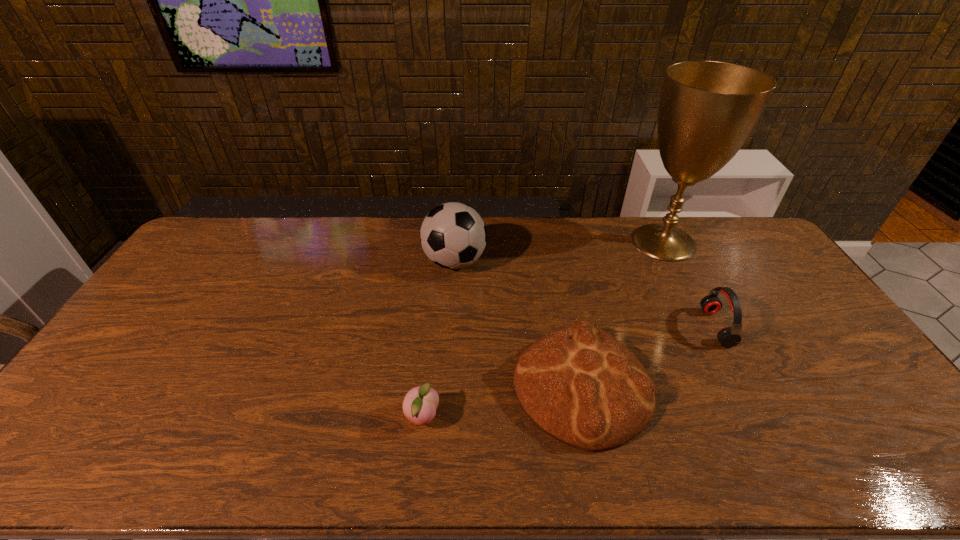
Where is `trophy cup`? The width and height of the screenshot is (960, 540). trophy cup is located at coordinates (708, 109).

What are the coordinates of `the fourth shortest object` in the screenshot? It's located at (453, 235).

In order to click on earphone in this screenshot , I will do `click(728, 337)`.

The width and height of the screenshot is (960, 540). I want to click on the third object from left to right, so click(x=582, y=386).

This screenshot has height=540, width=960. What are the coordinates of `the shortest object` in the screenshot? It's located at (419, 406).

In order to click on vacant space positioned on the left of the trophy cup in this screenshot , I will do click(529, 242).

The height and width of the screenshot is (540, 960). What are the coordinates of `vacant space situated 0.180m on the right of the soccer ball` in the screenshot? It's located at (538, 261).

The width and height of the screenshot is (960, 540). I want to click on free point located 0.330m on the ear cups of the earphone, so click(x=597, y=327).

Identify the location of free space located 0.270m on the ear cups of the earphone. The height and width of the screenshot is (540, 960). (617, 327).

Locate an element on the screen. free space located on the ear cups of the earphone is located at coordinates (608, 327).